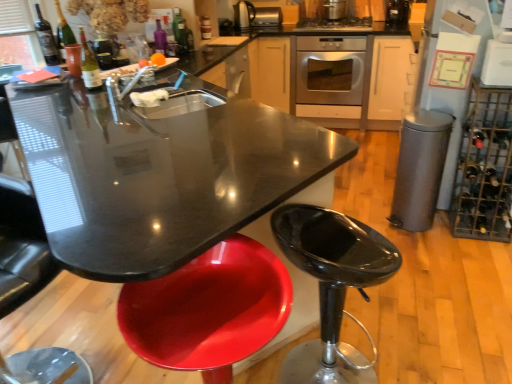
This screenshot has width=512, height=384. I want to click on vacant space that is to the left of metallic wire wine rack at right, so click(x=433, y=244).